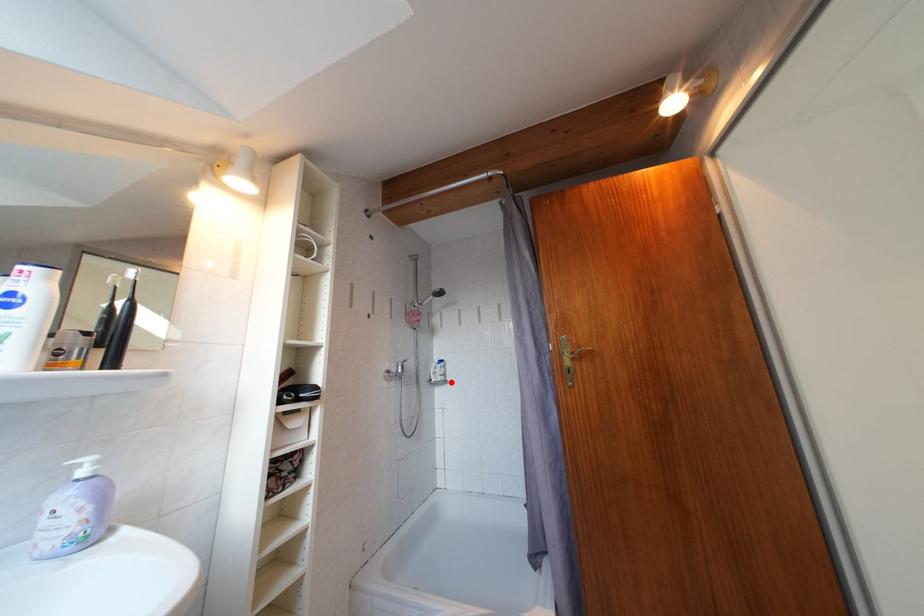
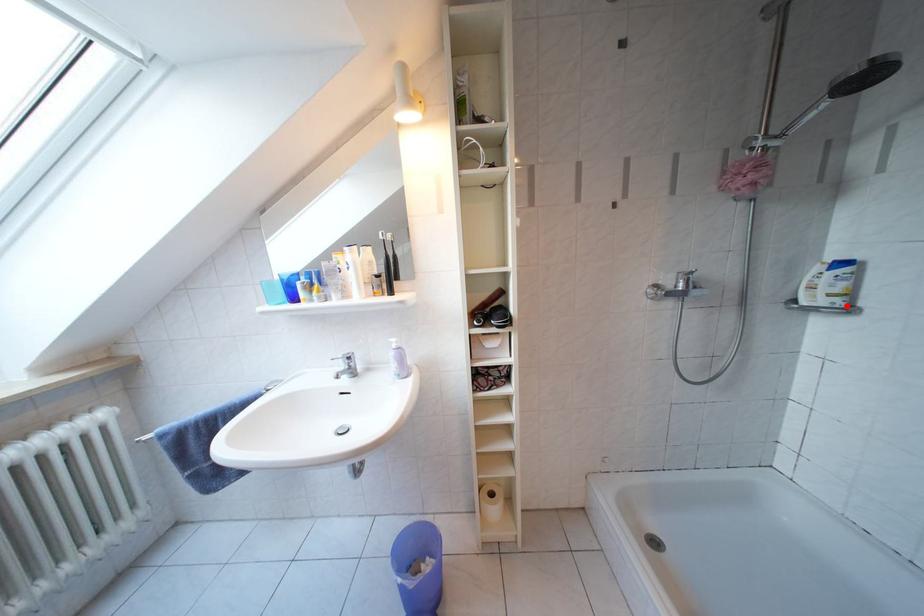
I am providing you with two images of the same scene from different viewpoints. A red point is marked on the first image and another point is marked on the second image. Do the highlighted points in image1 and image2 indicate the same real-world spot?

Yes